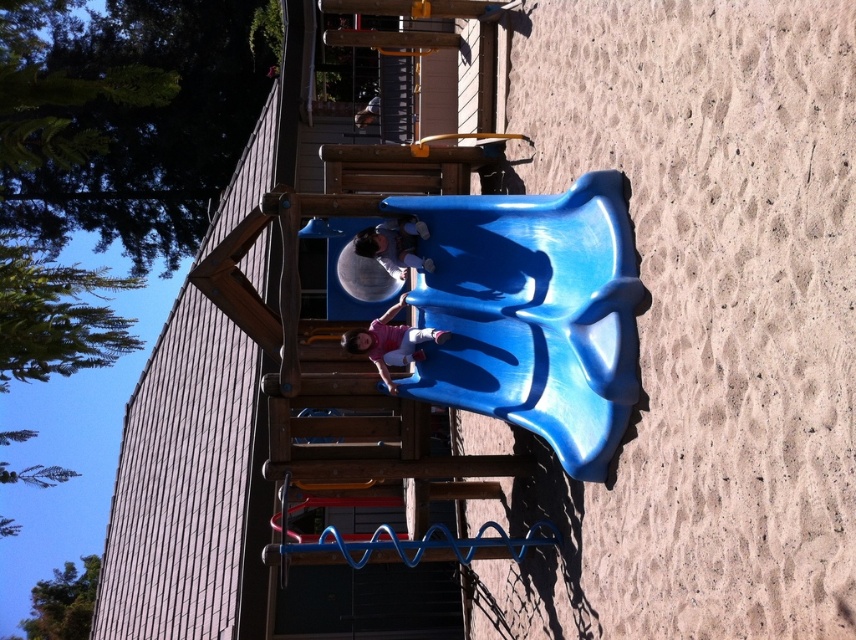
Consider the image. Is blue plastic slide at center shorter than matte pink shirt at center?

No, blue plastic slide at center is not shorter than matte pink shirt at center.

What do you see at coordinates (533, 312) in the screenshot? I see `blue plastic slide at center` at bounding box center [533, 312].

What do you see at coordinates (533, 312) in the screenshot?
I see `blue plastic slide at center` at bounding box center [533, 312].

Where is `blue plastic slide at center`? Image resolution: width=856 pixels, height=640 pixels. blue plastic slide at center is located at coordinates (533, 312).

Who is higher up, blue plastic slide at center or matte blue slide at center?

matte blue slide at center

Which is behind, point (339, 301) or point (394, 260)?

The point (339, 301) is more distant.

You are a GUI agent. You are given a task and a screenshot of the screen. Output one action in this format:
    pyautogui.click(x=<x>, y=<y>)
    Task: Click on the blue plastic slide at center
    The width and height of the screenshot is (856, 640).
    Given the screenshot: What is the action you would take?
    pyautogui.click(x=533, y=312)

Can you confirm if matte blue slide at center is thinner than matte black helmet at upper center?

In fact, matte blue slide at center might be wider than matte black helmet at upper center.

Image resolution: width=856 pixels, height=640 pixels. What do you see at coordinates (394, 244) in the screenshot? I see `matte blue slide at center` at bounding box center [394, 244].

The height and width of the screenshot is (640, 856). What do you see at coordinates (394, 244) in the screenshot?
I see `matte blue slide at center` at bounding box center [394, 244].

This screenshot has height=640, width=856. In order to click on matte blue slide at center in this screenshot , I will do `click(394, 244)`.